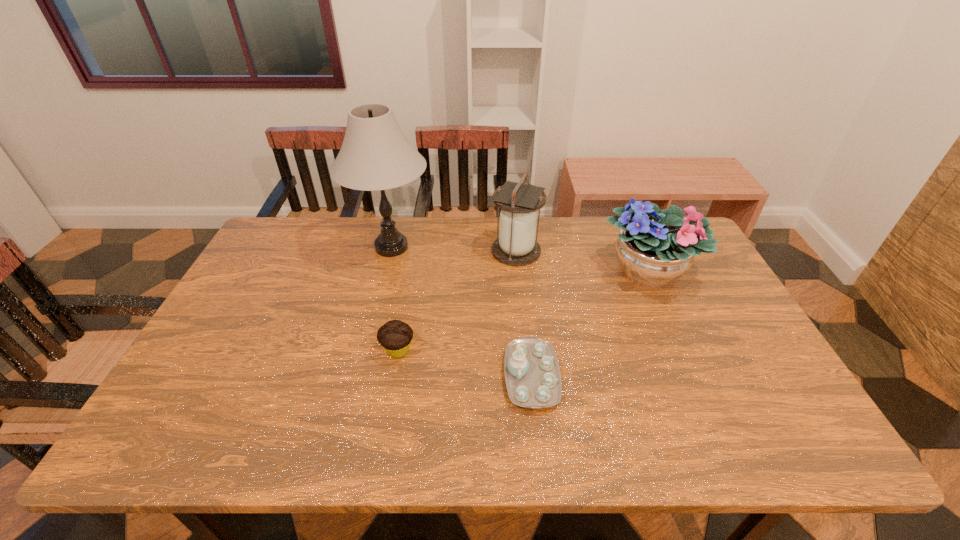
Identify the location of free space that satisfies the following two spatial constraints: 1. on the front side of the bouquet; 2. on the left side of the lantern. The width and height of the screenshot is (960, 540). (518, 272).

Identify the location of blank space that satisfies the following two spatial constraints: 1. on the back side of the muffin; 2. on the right side of the lantern. Image resolution: width=960 pixels, height=540 pixels. tap(416, 251).